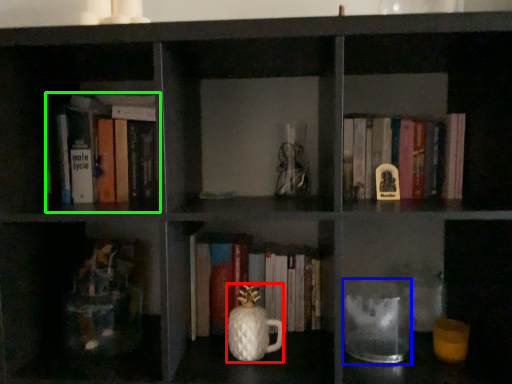
Question: Based on their relative distances, which object is farther from glass vase (highlighted by a red box)? Choose from glass jar (highlighted by a blue box) and book (highlighted by a green box).

Choices:
 (A) glass jar
 (B) book

Answer: (B)